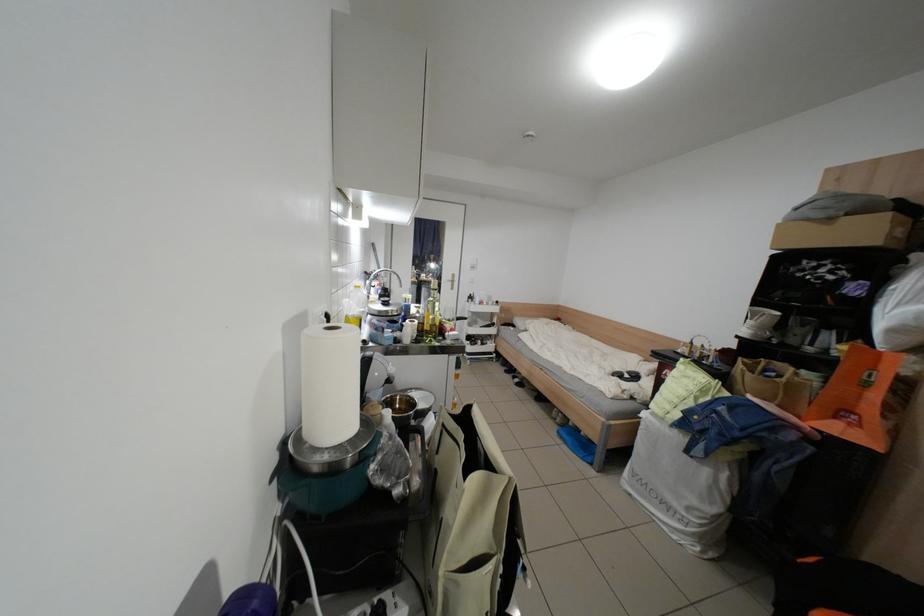
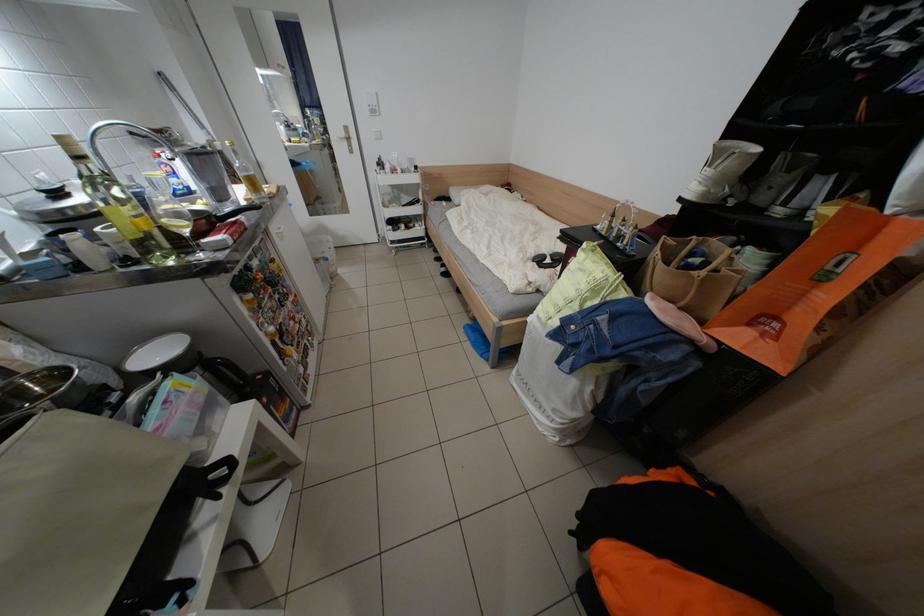
Find the pixel in the second image that matches point 619,376 in the first image.

(540, 261)